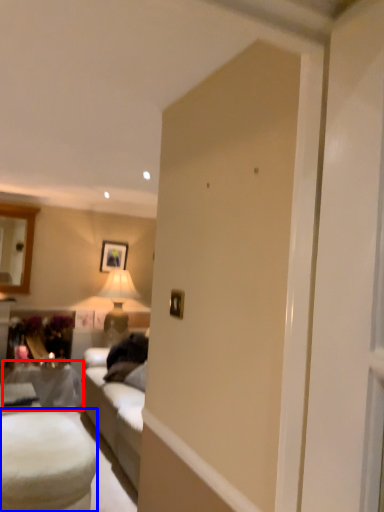
Question: Among these objects, which one is nearest to the camera, table (highlighted by a red box) or table (highlighted by a blue box)?

Choices:
 (A) table
 (B) table

Answer: (B)